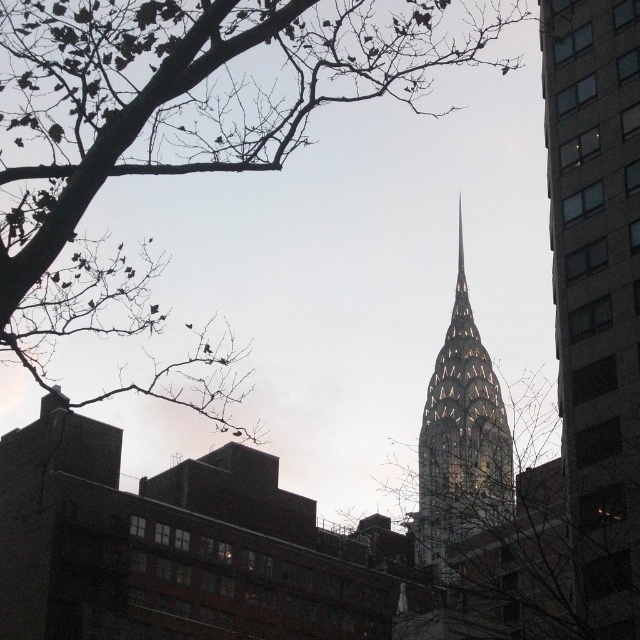
Question: Which point is closer to the camera?

Choices:
 (A) shiny glass tower at center
 (B) gray concrete building at center
 (C) brown leafy branches at upper left

Answer: (C)

Question: Which is farther from the shiny glass tower at center?

Choices:
 (A) brown leafy branches at upper left
 (B) gray concrete building at center

Answer: (B)

Question: Does brown leafy branches at upper left have a lesser width compared to shiny glass tower at center?

Choices:
 (A) no
 (B) yes

Answer: (A)

Question: Which of the following is the closest to the observer?

Choices:
 (A) (467, 371)
 (B) (420, 0)
 (C) (621, 28)

Answer: (C)

Question: Does gray concrete building at center appear on the right side of shiny glass tower at center?

Choices:
 (A) no
 (B) yes

Answer: (A)

Question: Where is brown leafy branches at upper left located in relation to gray concrete building at center in the image?

Choices:
 (A) above
 (B) below

Answer: (A)